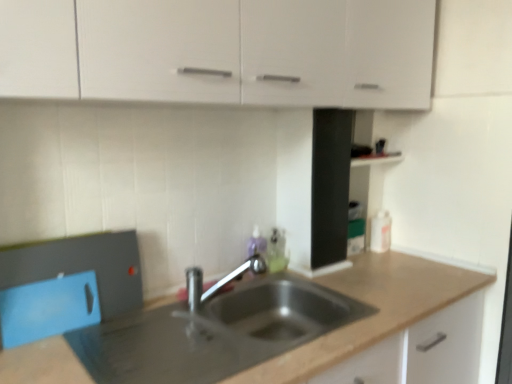
Question: Is metallic gray countertop at center wider than polished chrome tap at center?

Choices:
 (A) yes
 (B) no

Answer: (A)

Question: Considering the relative positions of metallic gray countertop at center and polished chrome tap at center in the image provided, is metallic gray countertop at center to the left of polished chrome tap at center from the viewer's perspective?

Choices:
 (A) yes
 (B) no

Answer: (B)

Question: Considering the relative sizes of metallic gray countertop at center and polished chrome tap at center in the image provided, is metallic gray countertop at center bigger than polished chrome tap at center?

Choices:
 (A) yes
 (B) no

Answer: (A)

Question: Are metallic gray countertop at center and polished chrome tap at center located far from each other?

Choices:
 (A) yes
 (B) no

Answer: (B)

Question: From a real-world perspective, is metallic gray countertop at center physically below polished chrome tap at center?

Choices:
 (A) no
 (B) yes

Answer: (B)

Question: Considering the relative positions of metallic gray countertop at center and white matte cabinet at upper center in the image provided, is metallic gray countertop at center to the left or to the right of white matte cabinet at upper center?

Choices:
 (A) left
 (B) right

Answer: (A)

Question: Would you say metallic gray countertop at center is inside or outside white matte cabinet at upper center?

Choices:
 (A) outside
 (B) inside

Answer: (A)

Question: From the image's perspective, is metallic gray countertop at center above or below white matte cabinet at upper center?

Choices:
 (A) above
 (B) below

Answer: (B)

Question: From a real-world perspective, relative to white matte cabinet at upper center, is metallic gray countertop at center vertically above or below?

Choices:
 (A) below
 (B) above

Answer: (A)

Question: In terms of width, does polished chrome tap at center look wider or thinner when compared to white matte cabinet at upper center?

Choices:
 (A) wide
 (B) thin

Answer: (B)

Question: From the image's perspective, relative to white matte cabinet at upper center, is polished chrome tap at center above or below?

Choices:
 (A) below
 (B) above

Answer: (A)

Question: Looking at the image, does polished chrome tap at center seem bigger or smaller compared to white matte cabinet at upper center?

Choices:
 (A) big
 (B) small

Answer: (B)

Question: Is polished chrome tap at center in front of or behind white matte cabinet at upper center in the image?

Choices:
 (A) behind
 (B) front

Answer: (A)

Question: Looking at their shapes, would you say polished chrome tap at center is wider or thinner than metallic gray countertop at center?

Choices:
 (A) thin
 (B) wide

Answer: (A)

Question: Does point (192, 319) appear closer or farther from the camera than point (426, 258)?

Choices:
 (A) closer
 (B) farther

Answer: (A)